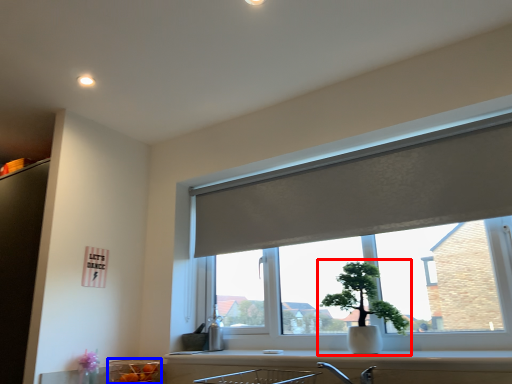
Question: Which of the following is the farthest to the observer, houseplant (highlighted by a red box) or glass bowl (highlighted by a blue box)?

Choices:
 (A) houseplant
 (B) glass bowl

Answer: (B)